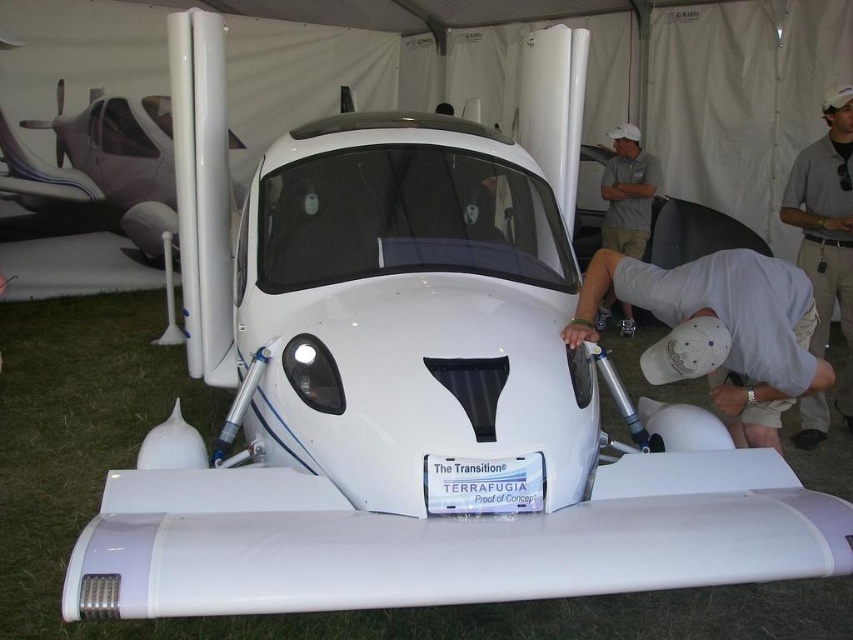
You are a designer evaluating the placement of accessories in the vehicle cockpit. You have a white matte helmet at lower center and a gray shirt at upper right. Which accessory occupies more space in the cockpit?

The gray shirt at upper right occupies more space in the cockpit because the white matte helmet at lower center has a smaller size compared to it.

Based on the photo, you are standing in front of a futuristic vehicle display. You see a white glossy airplane at upper left and a white cotton shirt at upper center. Which object is positioned more to the left?

The white glossy airplane at upper left is positioned more to the left than the white cotton shirt at upper center.